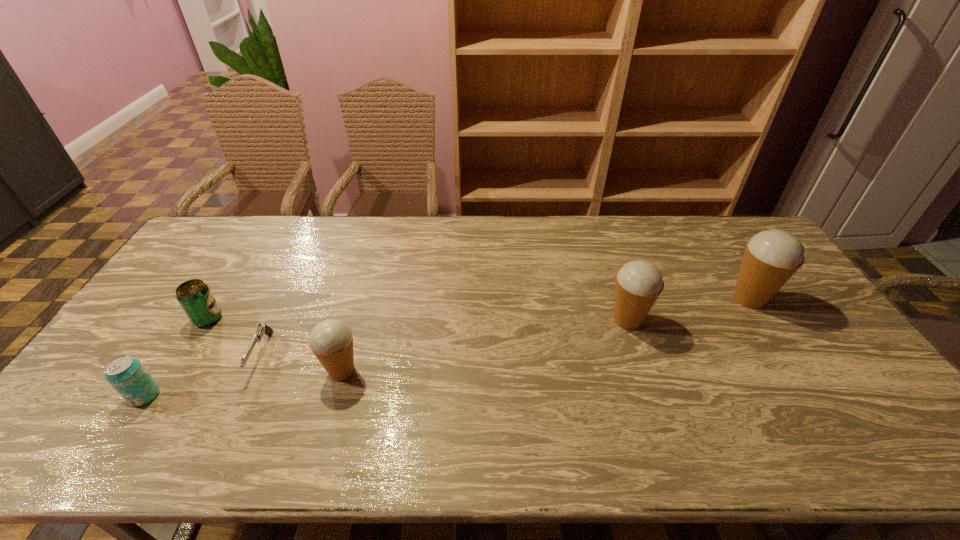
Image resolution: width=960 pixels, height=540 pixels. In order to click on vacant region that satisfies the following two spatial constraints: 1. on the back side of the second tallest icecream; 2. on the left side of the nearest icecream in this screenshot , I will do coord(356,320).

Find the location of a particular element. The width and height of the screenshot is (960, 540). free location that satisfies the following two spatial constraints: 1. on the back side of the second shortest icecream; 2. on the right side of the fourth shortest object is located at coordinates (356, 320).

You are a GUI agent. You are given a task and a screenshot of the screen. Output one action in this format:
    pyautogui.click(x=<x>, y=<y>)
    Task: Click on the free space that satisfies the following two spatial constraints: 1. on the back side of the nearer beer can; 2. on the right side of the second tallest icecream
    This screenshot has width=960, height=540.
    Given the screenshot: What is the action you would take?
    pyautogui.click(x=193, y=320)